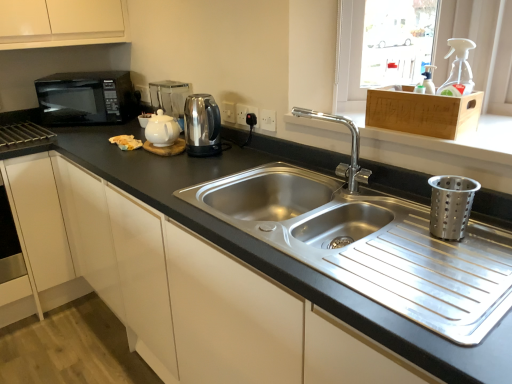
Question: Is wooden crate at upper right next to black granite countertop at center and touching it?

Choices:
 (A) yes
 (B) no

Answer: (B)

Question: Is wooden crate at upper right further to the viewer compared to black granite countertop at center?

Choices:
 (A) no
 (B) yes

Answer: (B)

Question: Is wooden crate at upper right not close to black granite countertop at center?

Choices:
 (A) yes
 (B) no

Answer: (B)

Question: Is wooden crate at upper right oriented away from black granite countertop at center?

Choices:
 (A) no
 (B) yes

Answer: (A)

Question: Is wooden crate at upper right to the left of black granite countertop at center from the viewer's perspective?

Choices:
 (A) no
 (B) yes

Answer: (A)

Question: Is wooden crate at upper right closer to camera compared to black granite countertop at center?

Choices:
 (A) yes
 (B) no

Answer: (B)

Question: Can you confirm if stainless steel kettle at center is thinner than white glossy tea pot at center?

Choices:
 (A) yes
 (B) no

Answer: (A)

Question: Does stainless steel kettle at center contain white glossy tea pot at center?

Choices:
 (A) no
 (B) yes

Answer: (A)

Question: From a real-world perspective, is stainless steel kettle at center on white glossy tea pot at center?

Choices:
 (A) yes
 (B) no

Answer: (A)

Question: Can you confirm if stainless steel kettle at center is shorter than white glossy tea pot at center?

Choices:
 (A) no
 (B) yes

Answer: (A)

Question: Can you confirm if stainless steel kettle at center is smaller than white glossy tea pot at center?

Choices:
 (A) yes
 (B) no

Answer: (B)

Question: Is stainless steel kettle at center positioned in front of white glossy tea pot at center?

Choices:
 (A) yes
 (B) no

Answer: (A)

Question: Is black matte microwave at left a part of metallic silver coffee machine at upper center?

Choices:
 (A) no
 (B) yes

Answer: (A)